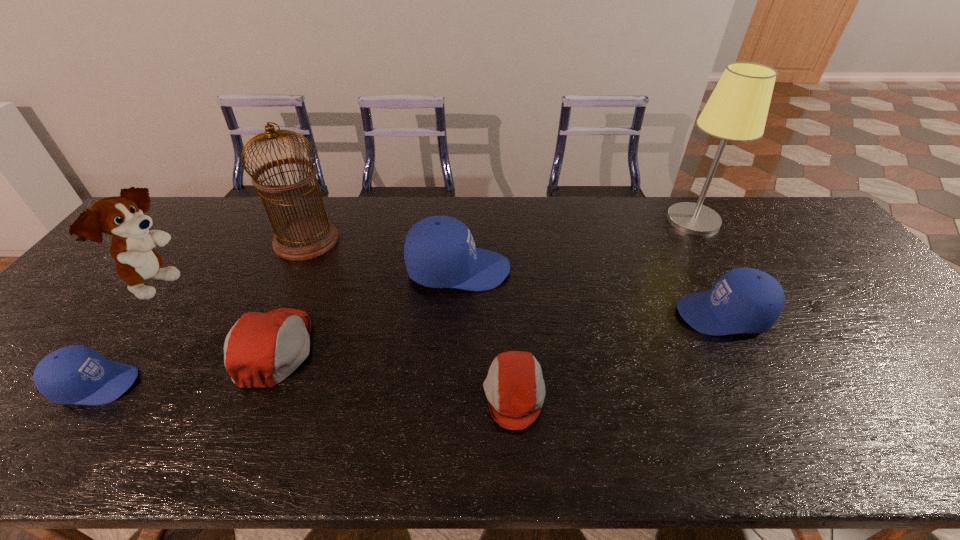
Locate an element on the screen. cap that is positioned at the left edge is located at coordinates (76, 374).

You are a GUI agent. You are given a task and a screenshot of the screen. Output one action in this format:
    pyautogui.click(x=<x>, y=<y>)
    Task: Click on the free location at the far edge of the desktop
    The height and width of the screenshot is (540, 960).
    Given the screenshot: What is the action you would take?
    pyautogui.click(x=528, y=207)

The height and width of the screenshot is (540, 960). In order to click on free location at the near edge in this screenshot , I will do `click(203, 436)`.

Locate an element on the screen. vacant region at the left edge is located at coordinates (32, 370).

Image resolution: width=960 pixels, height=540 pixels. Identify the location of blank space at the near right corner. (939, 434).

The height and width of the screenshot is (540, 960). What are the coordinates of `vacant region between the leftmost blue cap and the right red cap` in the screenshot? It's located at (305, 389).

You are a GUI agent. You are given a task and a screenshot of the screen. Output one action in this format:
    pyautogui.click(x=<x>, y=<y>)
    Task: Click on the unoccupied area between the shortest cap and the table lamp
    
    Given the screenshot: What is the action you would take?
    pyautogui.click(x=604, y=307)

You are a GUI agent. You are given a task and a screenshot of the screen. Output one action in this format:
    pyautogui.click(x=<x>, y=<y>)
    Task: Click on the vacant space that's between the bigger red cap and the fourth tallest object
    This screenshot has width=960, height=540.
    Given the screenshot: What is the action you would take?
    click(367, 309)

You are a GUI agent. You are given a task and a screenshot of the screen. Output one action in this format:
    pyautogui.click(x=<x>, y=<y>)
    Task: Click on the vacant space that is in between the puppy and the nearest blue cap
    This screenshot has height=540, width=960.
    Given the screenshot: What is the action you would take?
    pyautogui.click(x=127, y=335)

Image resolution: width=960 pixels, height=540 pixels. I want to click on free space between the smallest blue cap and the seventh shortest object, so click(202, 313).